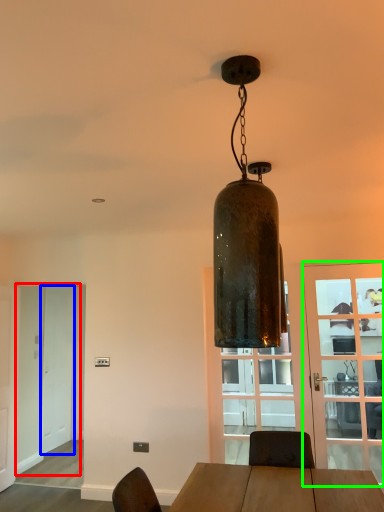
Question: Which object is positioned farthest from screen door (highlighted by a red box)? Select from screen door (highlighted by a blue box) and door (highlighted by a green box).

Choices:
 (A) screen door
 (B) door

Answer: (B)